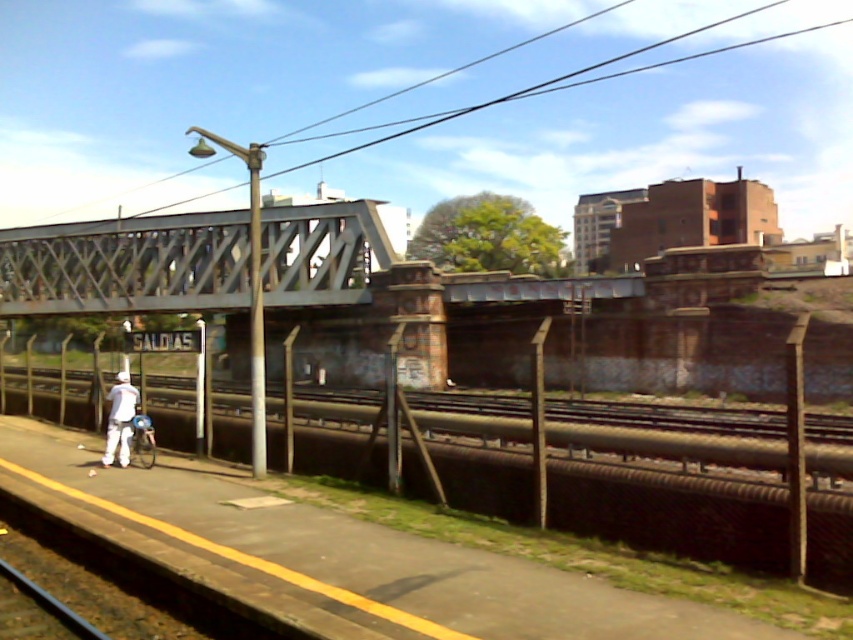
You are a railway worker inspecting the tracks. You notice the smooth metal rail at center and the metallic gray bridge at upper center. Which object takes up more space in the image?

The metallic gray bridge at upper center takes up more space in the image than the smooth metal rail at center.